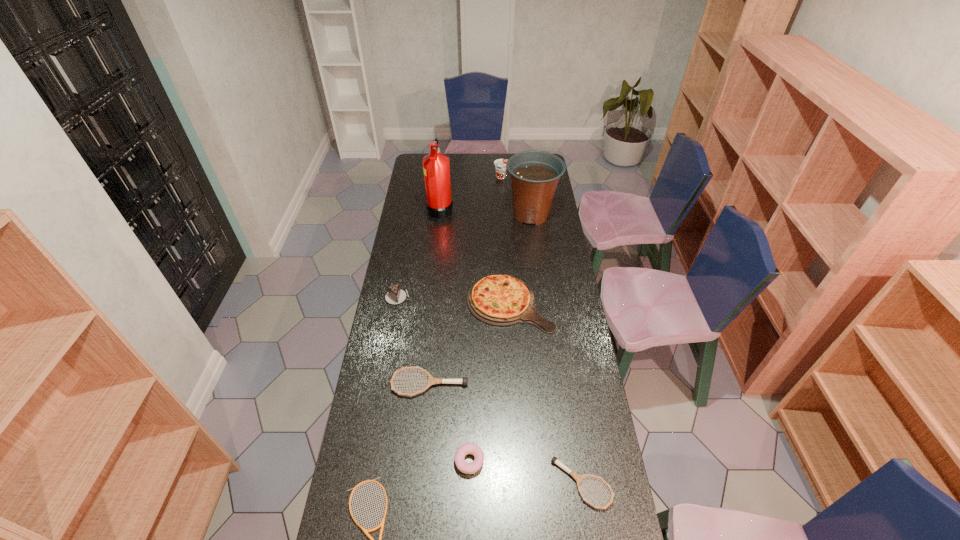
Find the location of a particular element. The image size is (960, 540). free spot located on the back of the nearer gray tennis racket is located at coordinates (567, 388).

The image size is (960, 540). Find the location of `object that is at the far edge`. object that is at the far edge is located at coordinates (500, 164).

Find the location of a particular element. This screenshot has width=960, height=540. fire extinguisher that is at the left edge is located at coordinates (439, 204).

The image size is (960, 540). I want to click on chocolate cake at the left edge, so click(395, 295).

At what (x,y) coordinates should I click in order to perform the action: click on tennis racket situated at the left edge. Please return your answer as a coordinate pair (x, y). Looking at the image, I should click on (431, 380).

Where is `flowerpot at the right edge`? flowerpot at the right edge is located at coordinates (534, 174).

Where is `pizza positioned at the right edge`? This screenshot has height=540, width=960. pizza positioned at the right edge is located at coordinates (500, 300).

The width and height of the screenshot is (960, 540). What are the coordinates of `tennis racket at the right edge` in the screenshot? It's located at (577, 477).

At what (x,y) coordinates should I click in order to perform the action: click on free spot at the far edge of the desktop. Please return your answer as a coordinate pair (x, y). Looking at the image, I should click on (500, 157).

Identify the location of free space at the left edge of the desktop. (411, 261).